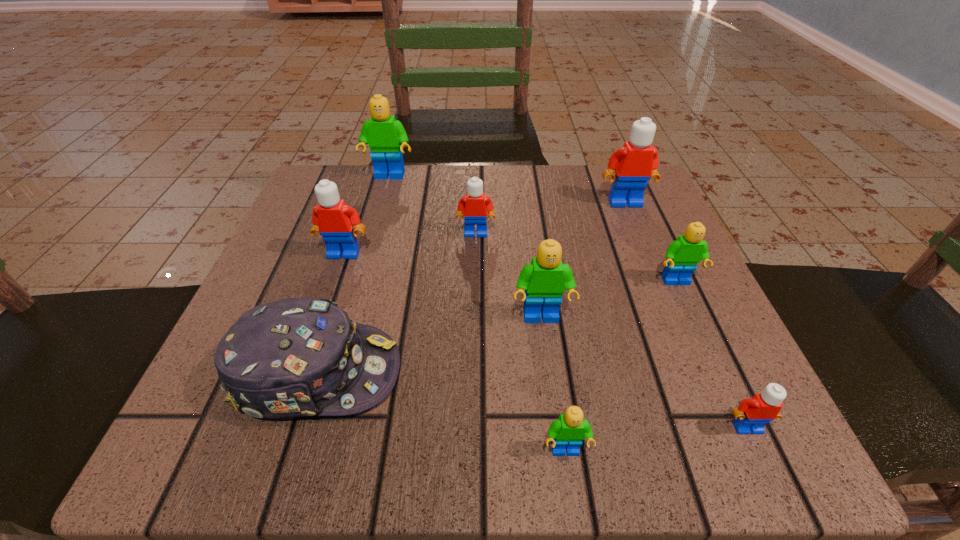
This screenshot has width=960, height=540. In order to click on white Lego that stands as the second closest to the nearest object in this screenshot , I will do [475, 207].

At what (x,y) coordinates should I click in order to perform the action: click on white Lego identified as the closest to the fourth object from left to right. Please return your answer as a coordinate pair (x, y). Image resolution: width=960 pixels, height=540 pixels. Looking at the image, I should click on (334, 220).

Where is `the closest green Lego to the second farthest white Lego`? the closest green Lego to the second farthest white Lego is located at coordinates (544, 280).

Locate an element on the screen. green Lego that is the second nearest to the nearest Lego is located at coordinates (682, 255).

The width and height of the screenshot is (960, 540). I want to click on free space that satisfies the following two spatial constraints: 1. on the face of the seventh nearest Lego; 2. on the front-facing side of the headwear, so click(695, 373).

Where is `vacant space that satisfies the following two spatial constraints: 1. on the face of the biggest white Lego; 2. on the front-facing side of the headwear`? The width and height of the screenshot is (960, 540). vacant space that satisfies the following two spatial constraints: 1. on the face of the biggest white Lego; 2. on the front-facing side of the headwear is located at coordinates (695, 373).